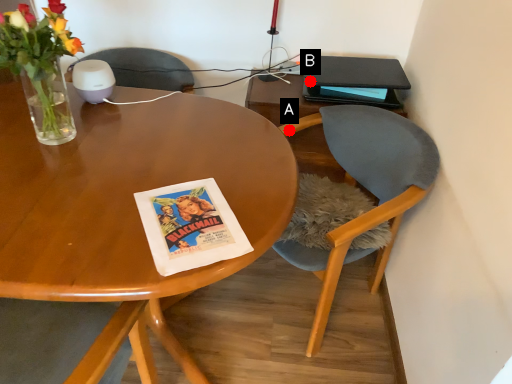
Question: Two points are circled on the image, labeled by A and B beside each circle. Which of the following is the closest to the observer?

Choices:
 (A) A is closer
 (B) B is closer

Answer: (A)